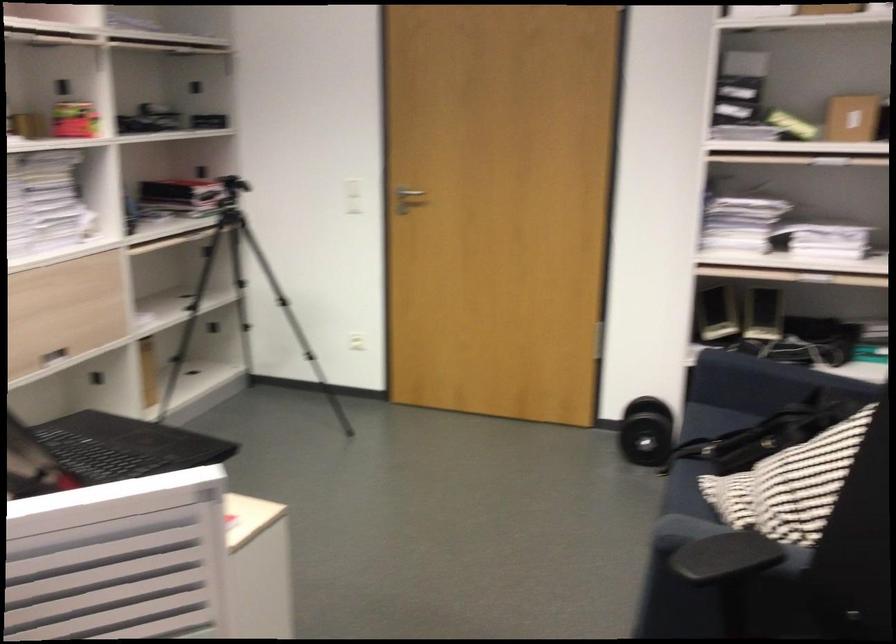
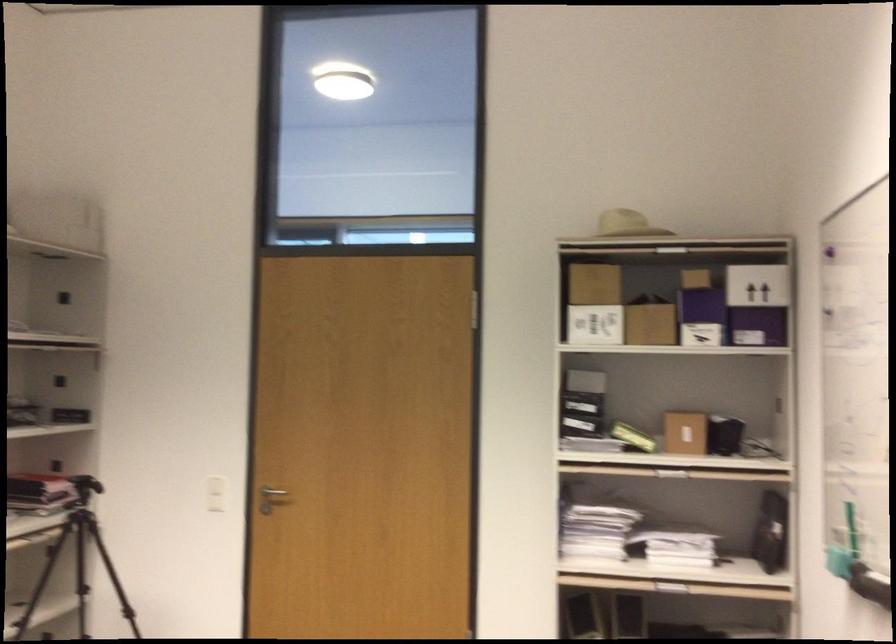
Locate, in the second image, the point that corresponds to [352,194] in the first image.

(216, 494)